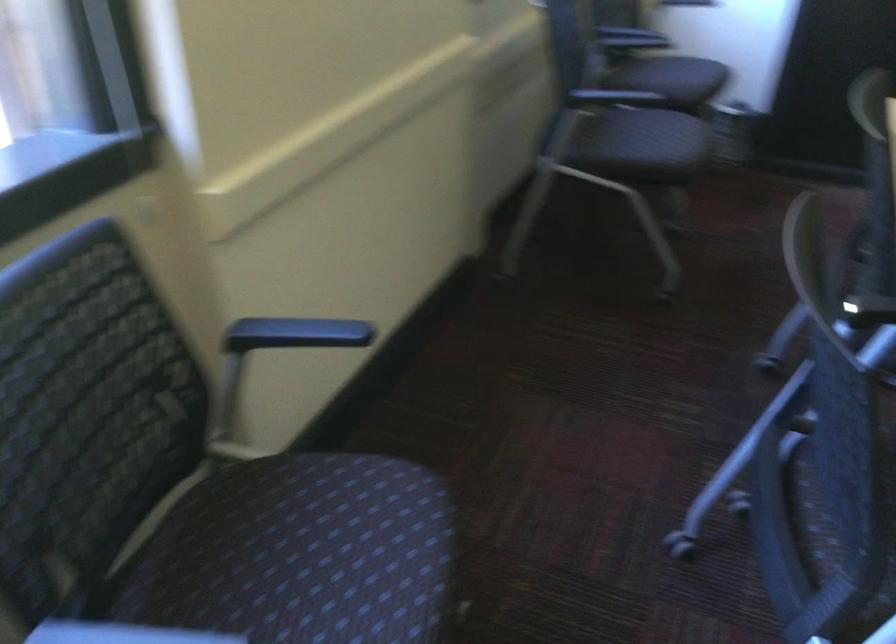
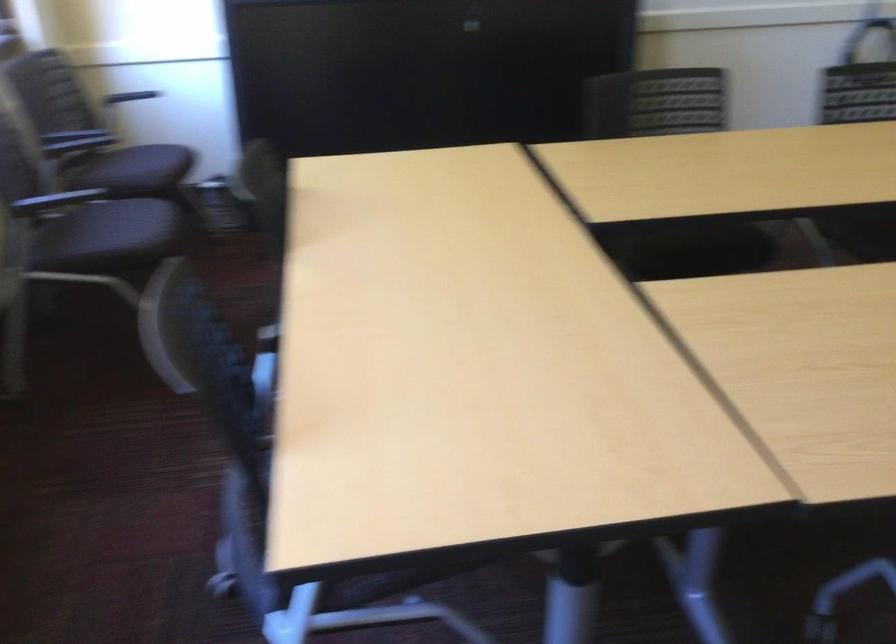
In the second image, find the point that corresponds to the point at 648,142 in the first image.

(116, 234)